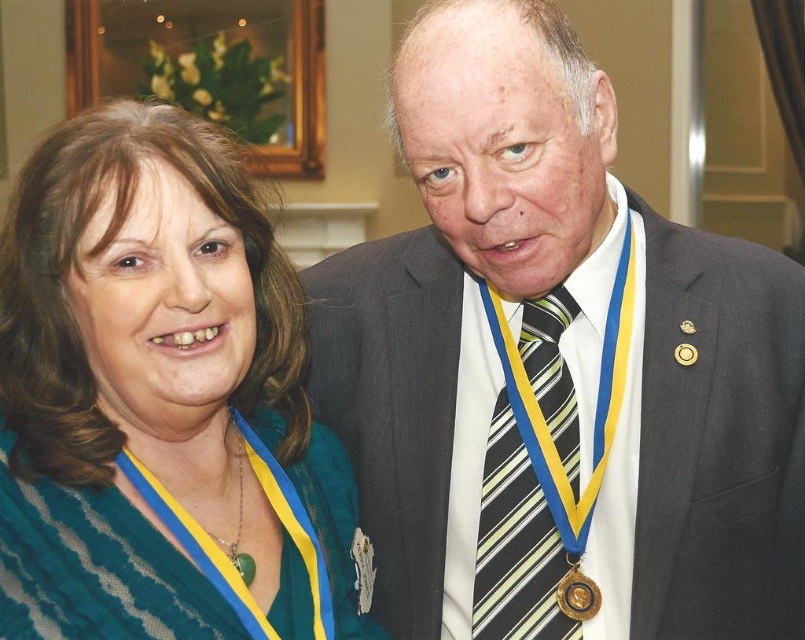
Is green fabric scarf at left shorter than striped fabric tie at right?

No.

Between point (221, 355) and point (576, 432), which one is positioned behind?

Positioned behind is point (576, 432).

Locate an element on the screen. Image resolution: width=805 pixels, height=640 pixels. green fabric scarf at left is located at coordinates pos(155,392).

Can you confirm if striped fabric tie at right is positioned below gold metallic medal at lower right?

No.

You are a GUI agent. You are given a task and a screenshot of the screen. Output one action in this format:
    pyautogui.click(x=<x>, y=<y>)
    Task: Click on the striped fabric tie at right
    
    Given the screenshot: What is the action you would take?
    pyautogui.click(x=515, y=541)

What are the coordinates of `striped fabric tie at right` in the screenshot? It's located at (515, 541).

Does green fabric scarf at left come behind gold metallic medal at lower right?

No, it is in front of gold metallic medal at lower right.

Does green fabric scarf at left have a lesser width compared to gold metallic medal at lower right?

No.

Looking at this image, who is more distant from viewer, (180, 326) or (568, 589)?

The point (568, 589) is behind.

Locate an element on the screen. The image size is (805, 640). green fabric scarf at left is located at coordinates (155, 392).